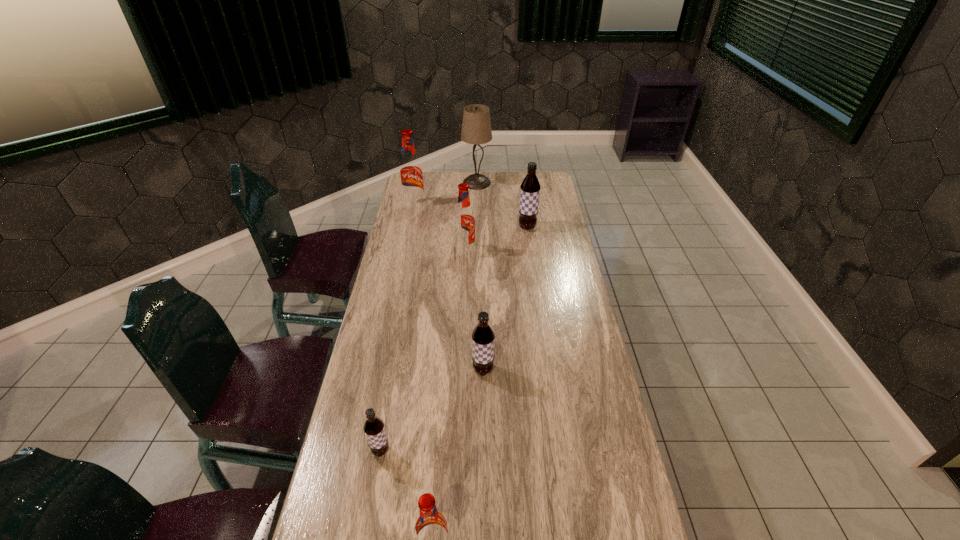
This screenshot has width=960, height=540. I want to click on free space at the left edge of the desktop, so click(x=395, y=339).

In the image, there is a desktop. In order to click on vacant space at the right edge in this screenshot , I will do `click(553, 197)`.

Locate an element on the screen. vacant space at the far left corner of the desktop is located at coordinates (426, 176).

I want to click on empty space between the second smallest red root beer and the fourth farthest root beer, so click(x=474, y=310).

This screenshot has height=540, width=960. Find the location of `vacant space that's between the rightmost brown root beer and the farthest object`. vacant space that's between the rightmost brown root beer and the farthest object is located at coordinates (502, 205).

Image resolution: width=960 pixels, height=540 pixels. In order to click on free spot between the rightmost root beer and the farthest object in this screenshot , I will do `click(502, 205)`.

The width and height of the screenshot is (960, 540). What are the coordinates of `vacant space that's between the farthest object and the second farthest object` in the screenshot? It's located at (445, 194).

This screenshot has width=960, height=540. Identify the location of object that is the third closest one to the farthest root beer. (530, 187).

Where is `object that is the third closest one to the biggest red root beer`? Image resolution: width=960 pixels, height=540 pixels. object that is the third closest one to the biggest red root beer is located at coordinates [530, 187].

Identify which root beer is located as the second nearest to the fourth farthest root beer. Please provide its 2D coordinates. Your answer should be formatted as a tuple, i.e. [(x, y)], where the tuple contains the x and y coordinates of a point satisfying the conditions above.

[(431, 530)]